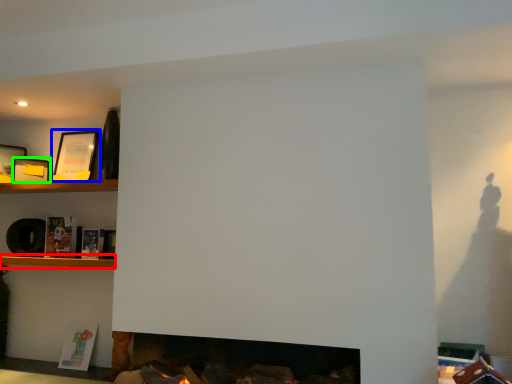
Question: Estimate the real-world distances between objects in this image. Which object is farther from shelf (highlighted by a red box), picture frame (highlighted by a blue box) or picture frame (highlighted by a green box)?

Choices:
 (A) picture frame
 (B) picture frame

Answer: (A)